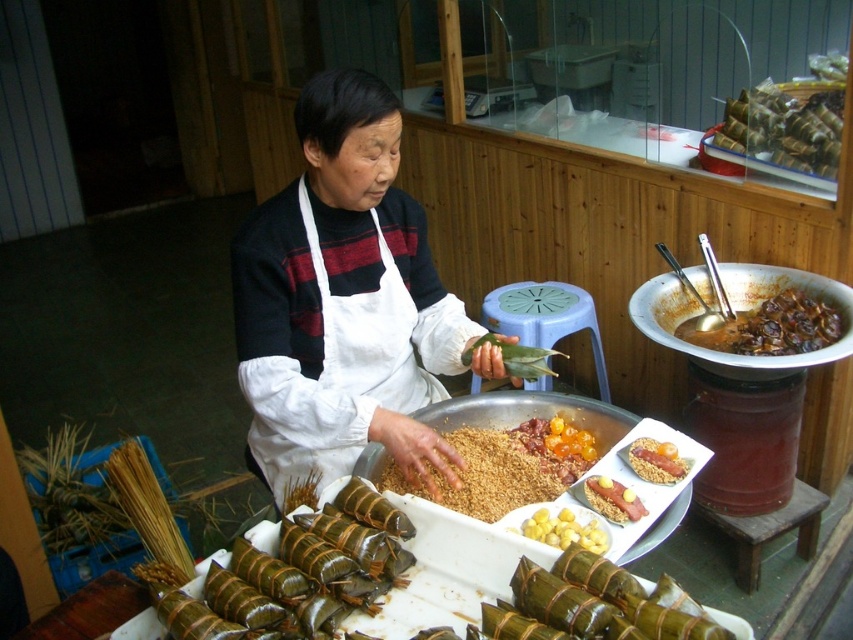
Question: Estimate the real-world distances between objects in this image. Which object is closer to the green bamboo leaves at lower left?

Choices:
 (A) green leafy wrapped dumplings at upper right
 (B) white fabric apron at center
 (C) brown glossy stew at right

Answer: (B)

Question: Is the position of green bamboo leaves at lower left less distant than that of yellow matte nuts at center?

Choices:
 (A) no
 (B) yes

Answer: (B)

Question: Which object is the closest to the brown glossy stew at right?

Choices:
 (A) brown crumbly rice at center
 (B) yellow matte rice at center

Answer: (A)

Question: Does green leafy wrapped dumplings at upper right appear over yellow matte rice at center?

Choices:
 (A) yes
 (B) no

Answer: (A)

Question: Which object appears closest to the camera in this image?

Choices:
 (A) green leafy wrapped dumplings at upper right
 (B) white fabric apron at center

Answer: (B)

Question: Does white fabric apron at center have a greater width compared to green bamboo leaves at lower left?

Choices:
 (A) no
 (B) yes

Answer: (B)